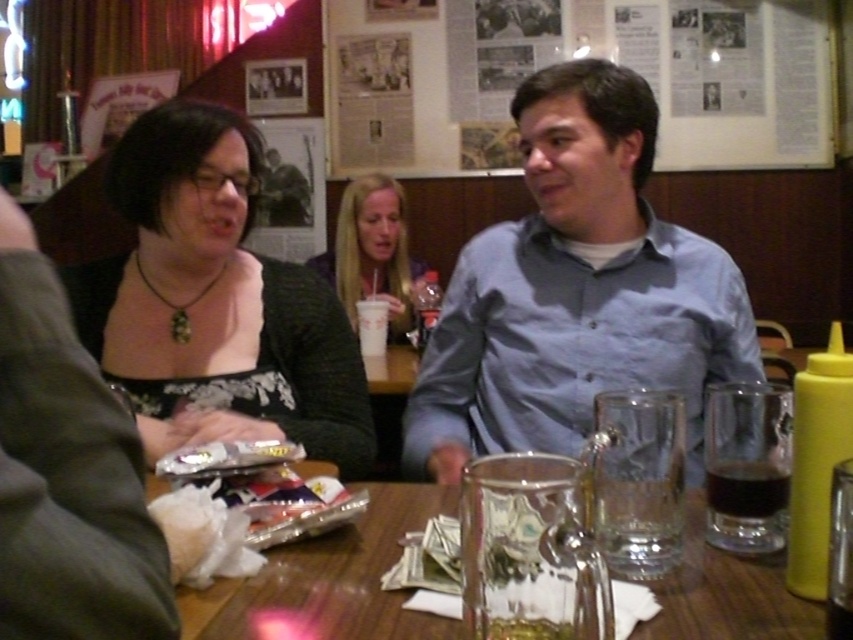
You are a waiter in a restaurant. You see a blue cotton shirt at center and a shiny foil snack at center on the table. Which item is closer to the right edge of the table?

The blue cotton shirt at center is to the right of the shiny foil snack at center, so the blue cotton shirt at center is closer to the right edge of the table.